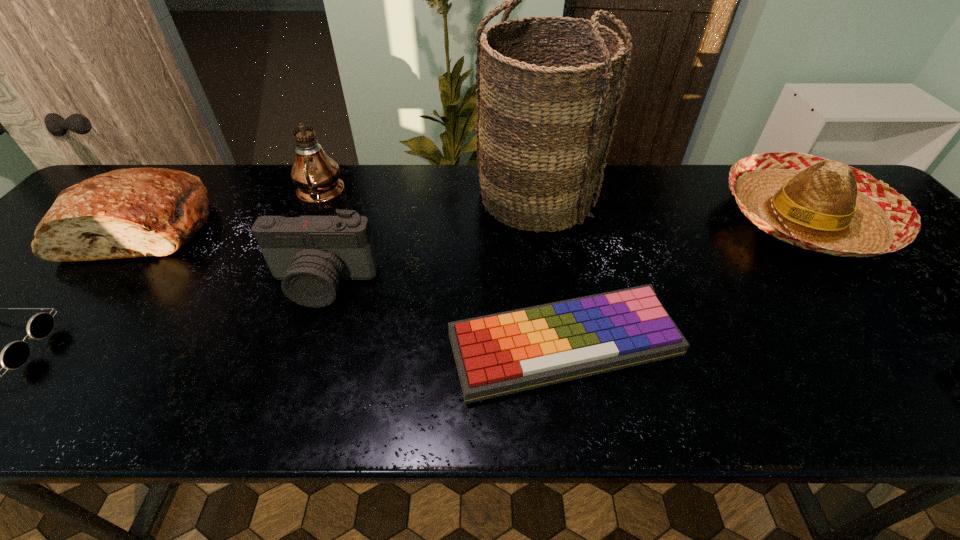
Identify which object is located as the third nearest to the computer keyboard. Please provide its 2D coordinates. Your answer should be formatted as a tuple, i.e. [(x, y)], where the tuple contains the x and y coordinates of a point satisfying the conditions above.

[(818, 204)]

The height and width of the screenshot is (540, 960). I want to click on free space that satisfies the following two spatial constraints: 1. at the sliced front of the bread; 2. on the left side of the computer keyboard, so click(50, 345).

Locate an element on the screen. The height and width of the screenshot is (540, 960). free point that satisfies the following two spatial constraints: 1. on the front side of the second tallest object; 2. on the right side of the sombrero is located at coordinates (309, 218).